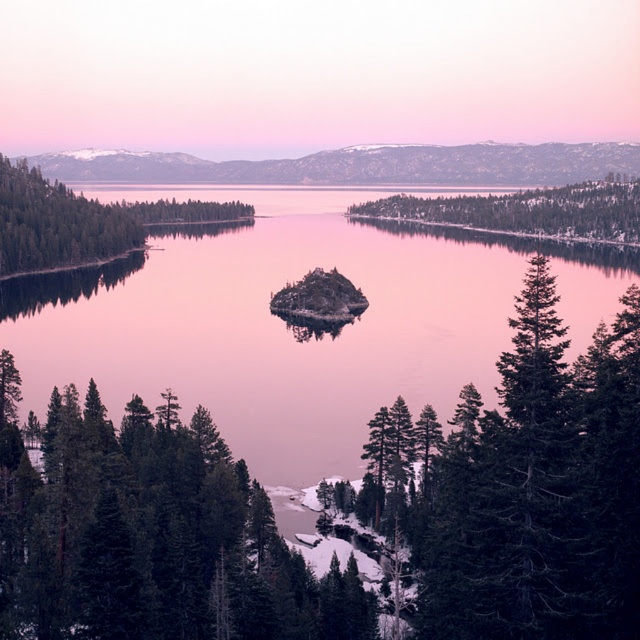
You are standing at the edge of the lake and notice a point marked at coordinates (x=273, y=326). What is the nature of the location at this point?

The point at coordinates (x=273, y=326) corresponds to clear water at center, so it is a clear area of the lake.

You are an environmental scientist observing the landscape. You need to determine which object, the green matte island at center or the green matte tree at left, has a greater height. Based on the scene, which one is taller?

The green matte tree at left is taller than the green matte island at center.

You are a photographer planning to capture the reflection of the rocky island on the clear water at center. Based on the scene description, where should you position your camera to ensure the reflection is fully visible?

You should position your camera directly above the clear water at center at point [273,326] to ensure the reflection of the rocky island is fully visible.